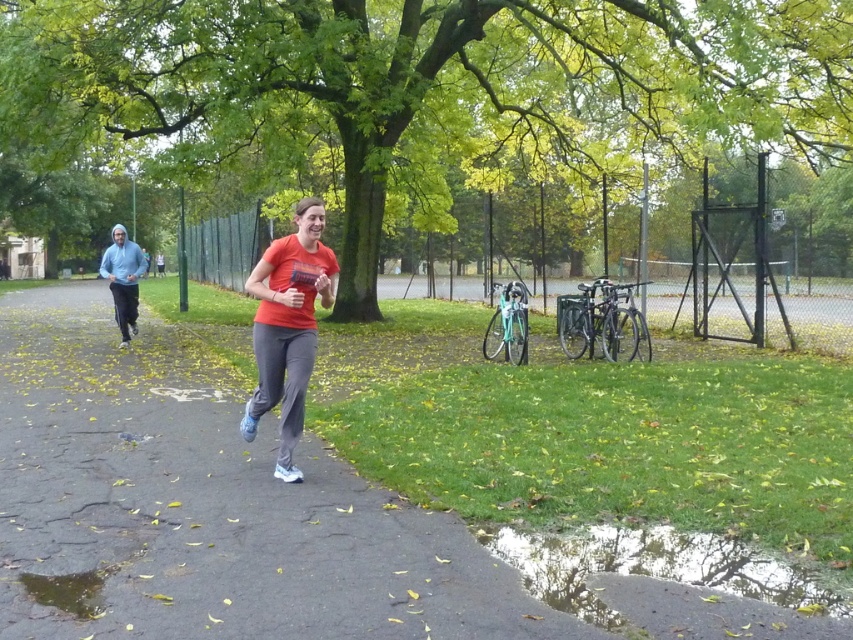
Question: Which object is farther from the camera taking this photo?

Choices:
 (A) orange matte shirt at center
 (B) smooth asphalt path at center
 (C) light blue hoodie at left

Answer: (C)

Question: Which object is closer to the camera taking this photo?

Choices:
 (A) light blue hoodie at left
 (B) orange matte shirt at center
 (C) smooth asphalt path at center
 (D) transparent water at lower center

Answer: (C)

Question: Is green leafy tree at center to the right of orange matte shirt at center from the viewer's perspective?

Choices:
 (A) yes
 (B) no

Answer: (B)

Question: Does green leafy tree at center appear on the right side of light blue hoodie at left?

Choices:
 (A) no
 (B) yes

Answer: (B)

Question: Which of the following is the farthest from the observer?

Choices:
 (A) (775, 589)
 (B) (671, 97)

Answer: (B)

Question: Is green leafy tree at center to the left of orange matte shirt at center from the viewer's perspective?

Choices:
 (A) no
 (B) yes

Answer: (B)